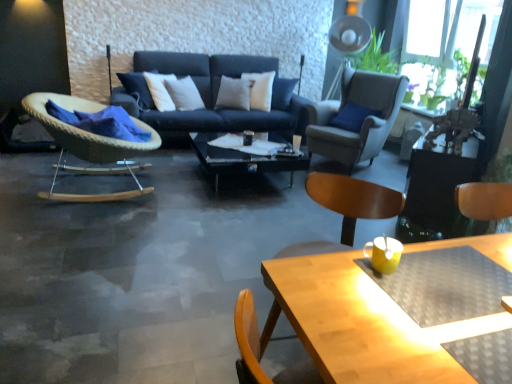
Question: Does point (309, 187) appear closer or farther from the camera than point (426, 107)?

Choices:
 (A) farther
 (B) closer

Answer: (B)

Question: Is wooden beach chair at lower right to the left or to the right of green leafy plant at upper right in the image?

Choices:
 (A) left
 (B) right

Answer: (A)

Question: Considering the real-world distances, which object is closest to the wooden beach chair at lower right?

Choices:
 (A) suede-like beige armchair at upper right, which appears as the second chair when viewed from the left
 (B) green leafy plant at upper right
 (C) wooden table at lower right
 (D) woven wood rocking chair at left, arranged as the first chair when viewed from the left
 (E) black glossy side table at right

Answer: (E)

Question: Which object is positioned closest to the wooden table at lower right?

Choices:
 (A) black glossy side table at right
 (B) wooden beach chair at lower right
 (C) transparent glass coffee table at center
 (D) woven wood rocking chair at left, arranged as the first chair when viewed from the left
 (E) suede-like beige armchair at upper right, which appears as the second chair when viewed from the left

Answer: (B)